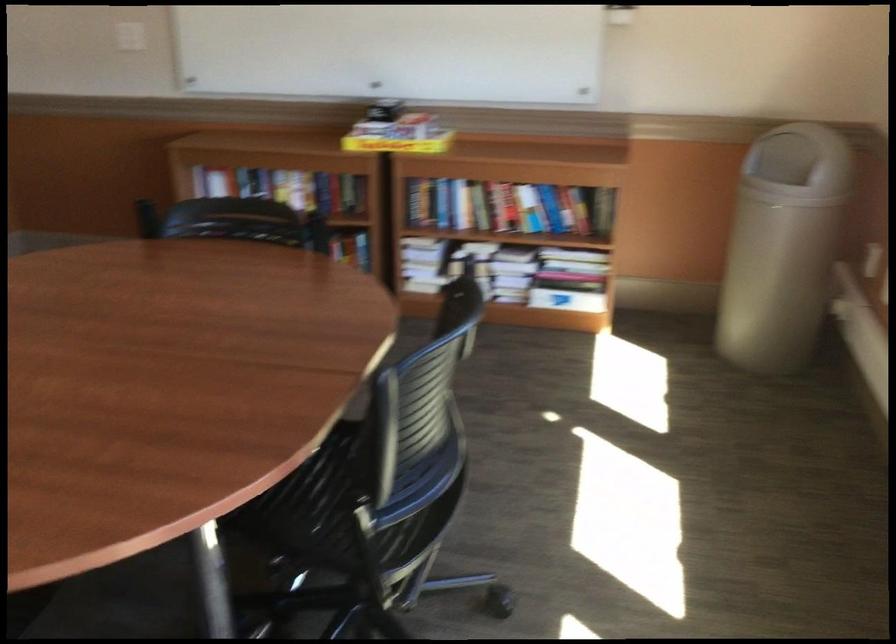
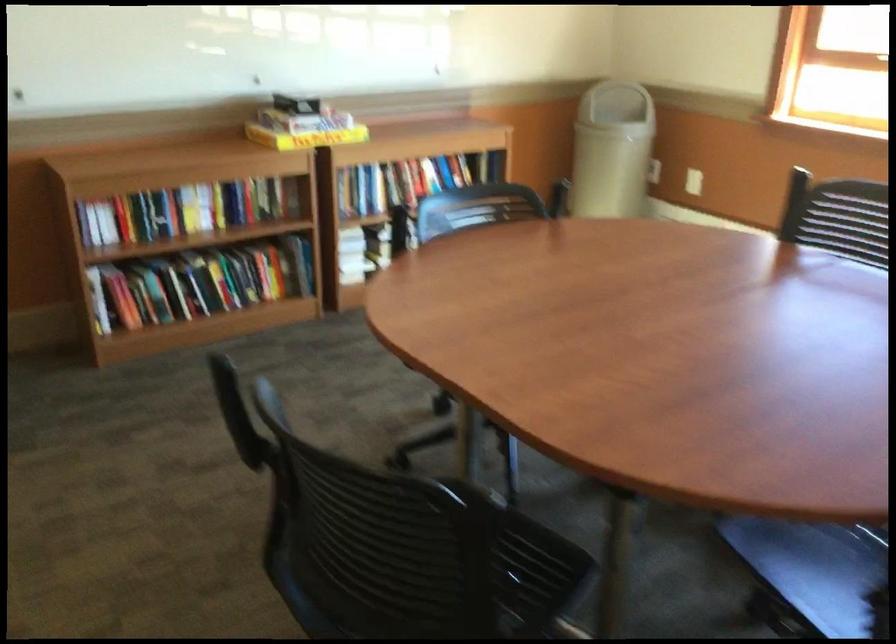
The point at (418, 149) is marked in the first image. Where is the corresponding point in the second image?

(306, 138)